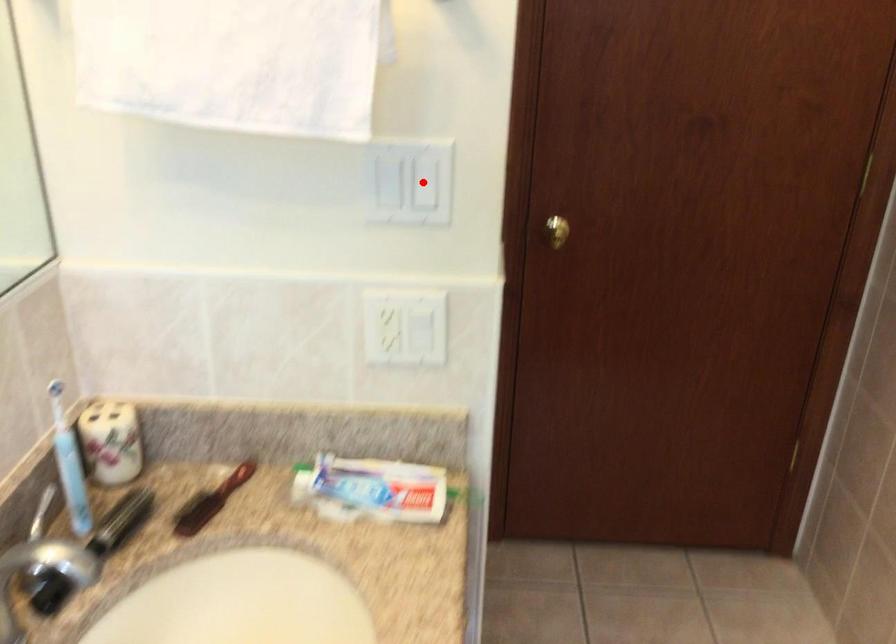
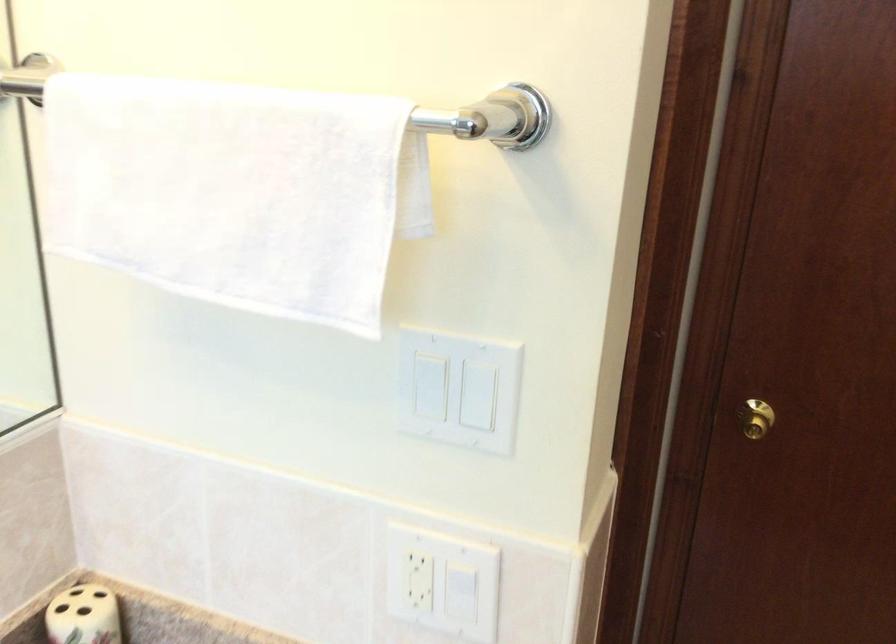
The point at the highlighted location is marked in the first image. Where is the corresponding point in the second image?

(483, 395)